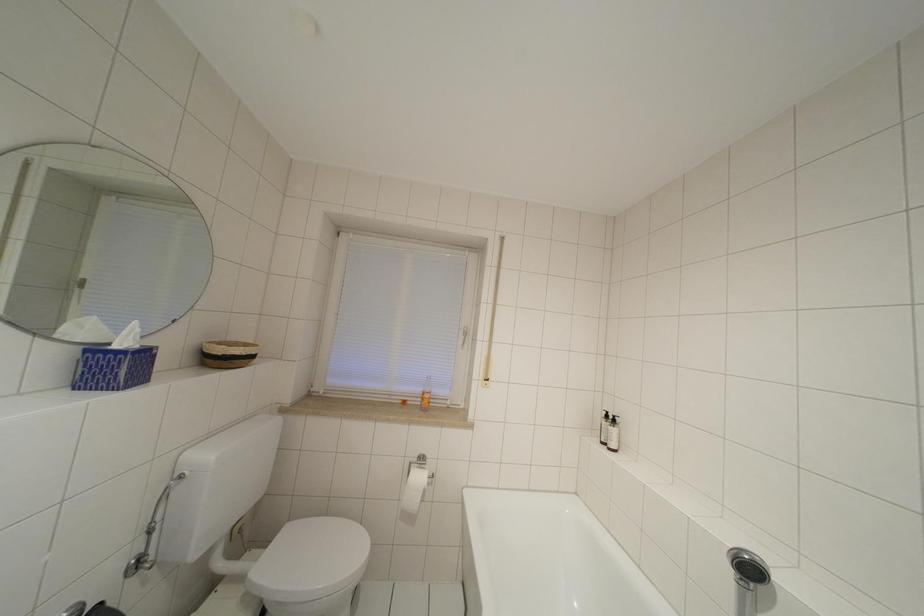
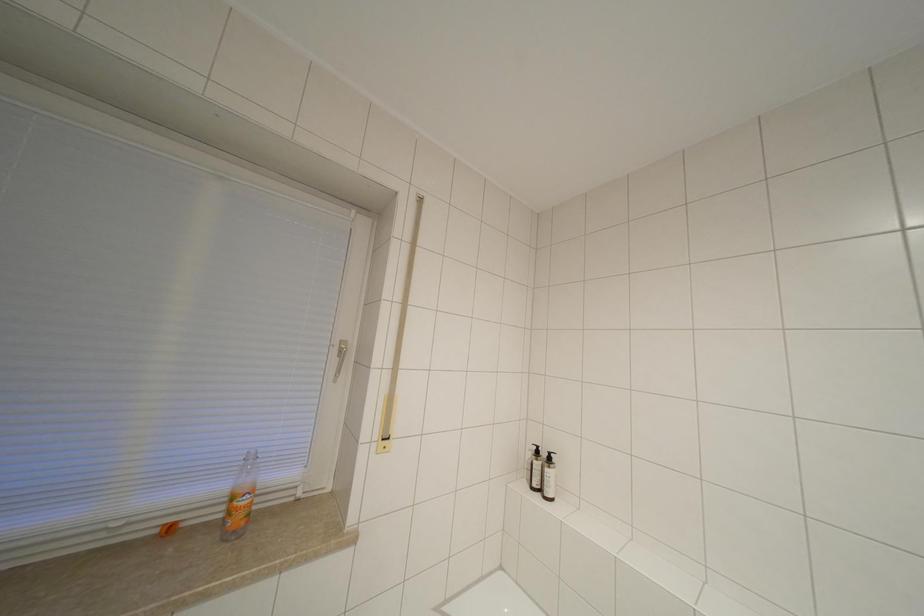
Question: How did the camera likely rotate?

Choices:
 (A) Left
 (B) Right
 (C) Up
 (D) Down

Answer: (B)